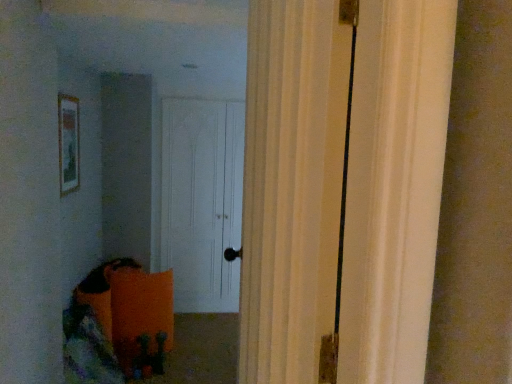
Question: Can you confirm if wooden framed picture at upper left is taller than white matte door at center?

Choices:
 (A) yes
 (B) no

Answer: (B)

Question: Is the position of wooden framed picture at upper left more distant than that of white matte door at center?

Choices:
 (A) yes
 (B) no

Answer: (B)

Question: From the image's perspective, is wooden framed picture at upper left over white matte door at center?

Choices:
 (A) no
 (B) yes

Answer: (B)

Question: Does wooden framed picture at upper left have a lesser height compared to white matte door at center?

Choices:
 (A) no
 (B) yes

Answer: (B)

Question: Can you see wooden framed picture at upper left touching white matte door at center?

Choices:
 (A) yes
 (B) no

Answer: (B)

Question: Is wooden framed picture at upper left smaller than white matte door at center?

Choices:
 (A) yes
 (B) no

Answer: (A)

Question: Are white matte door at center and wooden framed picture at upper left located far from each other?

Choices:
 (A) no
 (B) yes

Answer: (B)

Question: Considering the relative sizes of white matte door at center and wooden framed picture at upper left in the image provided, is white matte door at center wider than wooden framed picture at upper left?

Choices:
 (A) yes
 (B) no

Answer: (A)

Question: Is white matte door at center to the left of wooden framed picture at upper left from the viewer's perspective?

Choices:
 (A) no
 (B) yes

Answer: (A)

Question: Can you confirm if white matte door at center is shorter than wooden framed picture at upper left?

Choices:
 (A) no
 (B) yes

Answer: (A)

Question: Considering the relative sizes of white matte door at center and wooden framed picture at upper left in the image provided, is white matte door at center bigger than wooden framed picture at upper left?

Choices:
 (A) yes
 (B) no

Answer: (A)

Question: From a real-world perspective, is white matte door at center under wooden framed picture at upper left?

Choices:
 (A) no
 (B) yes

Answer: (B)

Question: In terms of height, does white matte door at center look taller or shorter compared to wooden framed picture at upper left?

Choices:
 (A) tall
 (B) short

Answer: (A)